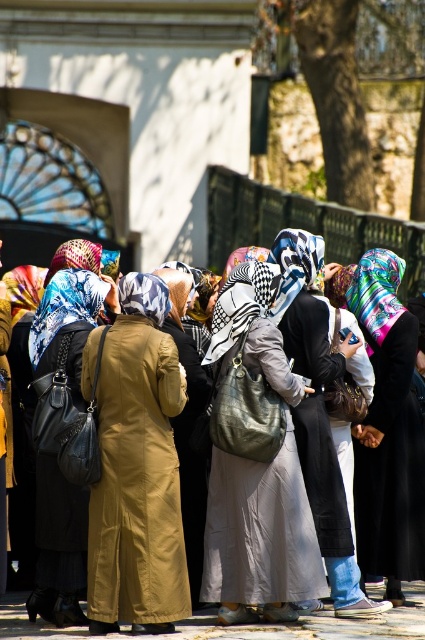
You are a photographer standing at a certain distance from the matte gray dress at center. You want to take a closeup shot of it. Considering the distance, would you need a zoom lens to capture the dress clearly?

The matte gray dress at center is 176.84 feet away from the viewer. To capture it clearly from that distance, a zoom lens would be necessary.

You are a photographer trying to capture the matte black dress at center in your shot. The camera you are using has a focus point at coordinates 0.642, 0.748. Will the focus point align with the dress?

Yes, the matte black dress at center is located exactly at point (x=317, y=410), so the focus point will align with the dress.

You are a fashion designer observing the scene and want to create a new scarf design. Which headscarf at center is shorter, the printed silk headscarf at center or the patterned silk headscarf at center?

The printed silk headscarf at center is shorter than the patterned silk headscarf at center.